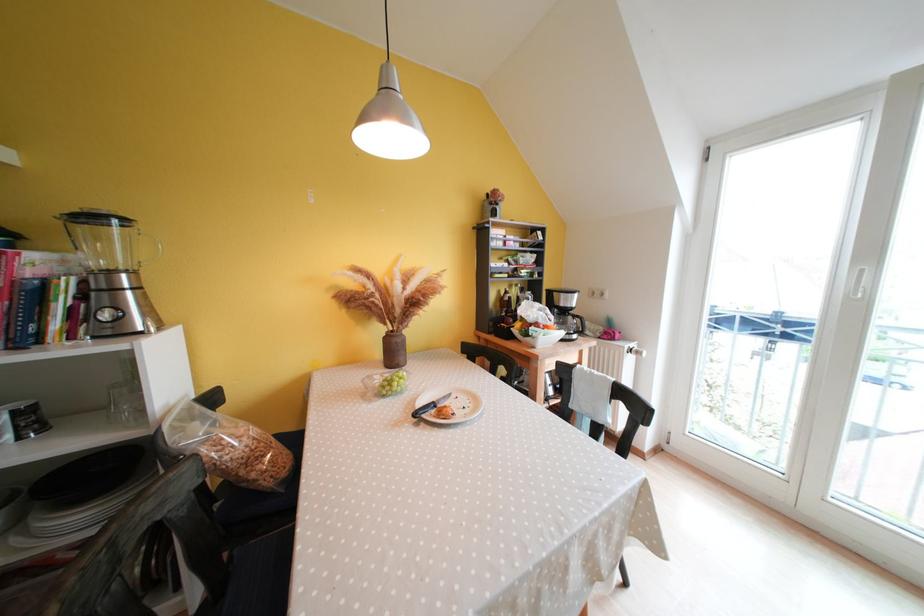
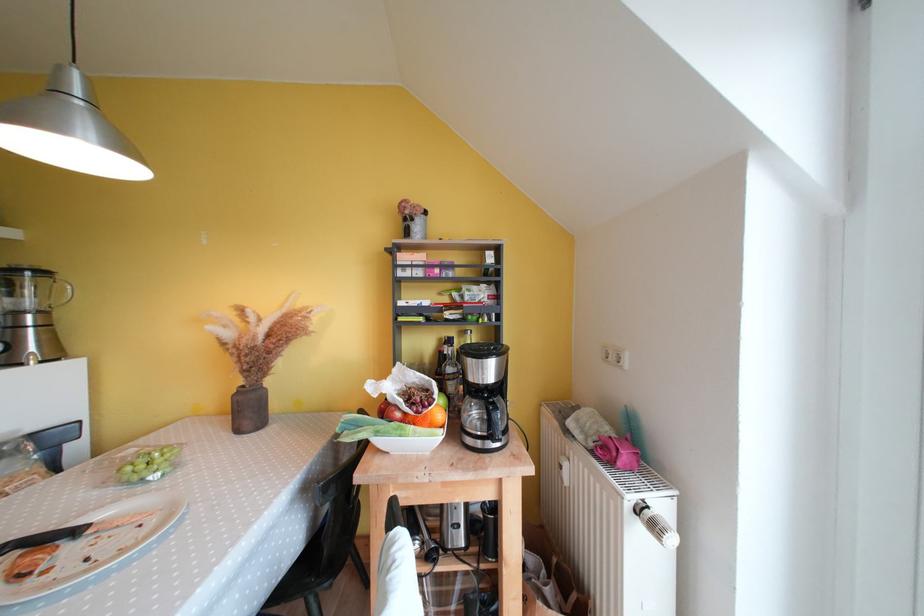
Find the pixel in the second image that matches point (140, 276) in the first image.

(49, 315)